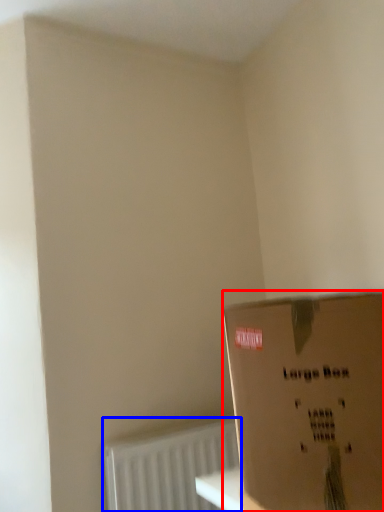
Question: Which point is closer to the camera, box (highlighted by a red box) or radiator (highlighted by a blue box)?

Choices:
 (A) box
 (B) radiator

Answer: (A)